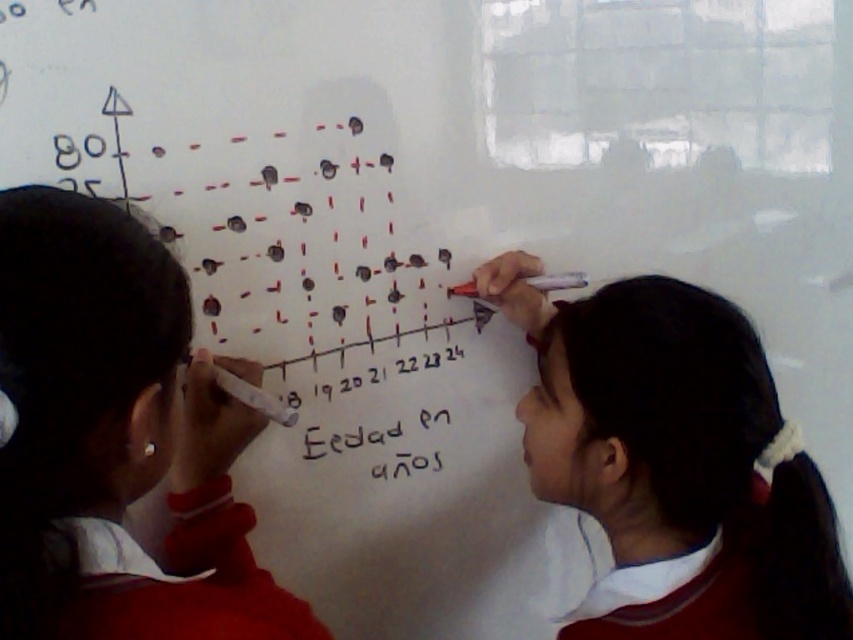
Question: Which point is closer to the camera?

Choices:
 (A) (645, 595)
 (B) (22, 268)

Answer: (B)

Question: Among these points, which one is nearest to the camera?

Choices:
 (A) (479, 289)
 (B) (181, 392)

Answer: (B)

Question: Which object appears closest to the camera in this image?

Choices:
 (A) white uniform at left
 (B) white matte marker at upper right

Answer: (A)

Question: Is white uniform at left bigger than white matte marker at upper right?

Choices:
 (A) no
 (B) yes

Answer: (A)

Question: Can you confirm if white uniform at left is positioned below white matte marker at upper right?

Choices:
 (A) no
 (B) yes

Answer: (A)

Question: Is white uniform at left closer to the viewer compared to white matte marker at upper right?

Choices:
 (A) no
 (B) yes

Answer: (B)